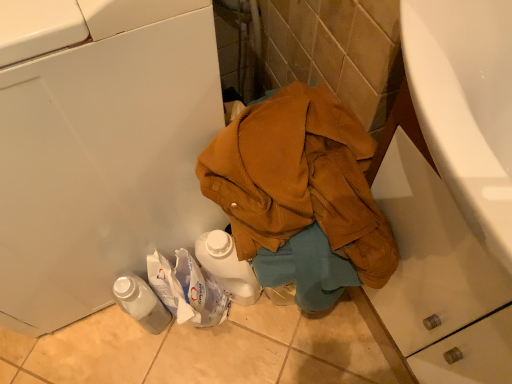
Question: Is brown corduroy jacket at center to the right of translucent plastic bottle at lower left from the viewer's perspective?

Choices:
 (A) yes
 (B) no

Answer: (A)

Question: From a real-world perspective, does brown corduroy jacket at center stand above translucent plastic bottle at lower left?

Choices:
 (A) yes
 (B) no

Answer: (A)

Question: Is brown corduroy jacket at center directly adjacent to translucent plastic bottle at lower left?

Choices:
 (A) no
 (B) yes

Answer: (A)

Question: From a real-world perspective, is brown corduroy jacket at center positioned under translucent plastic bottle at lower left based on gravity?

Choices:
 (A) no
 (B) yes

Answer: (A)

Question: Is brown corduroy jacket at center thinner than translucent plastic bottle at lower left?

Choices:
 (A) yes
 (B) no

Answer: (B)

Question: From a real-world perspective, is white plastic washing machine at lower left above or below brown corduroy jacket at center?

Choices:
 (A) above
 (B) below

Answer: (A)

Question: Relative to brown corduroy jacket at center, is white plastic washing machine at lower left in front or behind?

Choices:
 (A) behind
 (B) front

Answer: (B)

Question: Considering the positions of white plastic washing machine at lower left and brown corduroy jacket at center in the image, is white plastic washing machine at lower left taller or shorter than brown corduroy jacket at center?

Choices:
 (A) short
 (B) tall

Answer: (B)

Question: In the image, is white plastic washing machine at lower left on the left side or the right side of brown corduroy jacket at center?

Choices:
 (A) right
 (B) left

Answer: (B)

Question: From a real-world perspective, relative to brown corduroy jacket at center, is translucent plastic bottle at lower left vertically above or below?

Choices:
 (A) above
 (B) below

Answer: (B)

Question: Would you say translucent plastic bottle at lower left is to the left or to the right of brown corduroy jacket at center in the picture?

Choices:
 (A) right
 (B) left

Answer: (B)

Question: From the image's perspective, is translucent plastic bottle at lower left located above or below brown corduroy jacket at center?

Choices:
 (A) below
 (B) above

Answer: (A)

Question: Is point (158, 309) positioned closer to the camera than point (381, 230)?

Choices:
 (A) farther
 (B) closer

Answer: (A)

Question: Considering the relative positions of translucent plastic bottle at lower left and white plastic washing machine at lower left in the image provided, is translucent plastic bottle at lower left to the left or to the right of white plastic washing machine at lower left?

Choices:
 (A) right
 (B) left

Answer: (A)

Question: Is translucent plastic bottle at lower left taller or shorter than white plastic washing machine at lower left?

Choices:
 (A) short
 (B) tall

Answer: (A)